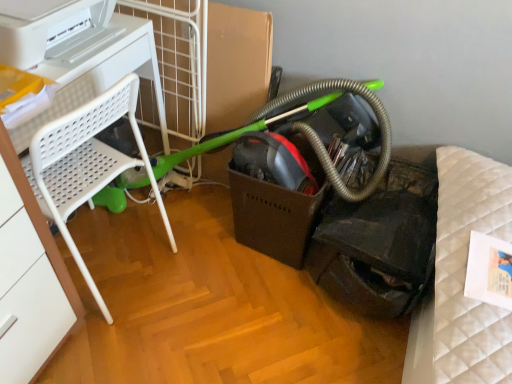
Question: From their relative heights in the image, would you say white plastic chair at left is taller or shorter than green rubber garden hose at center?

Choices:
 (A) short
 (B) tall

Answer: (B)

Question: Based on their sizes in the image, would you say white plastic chair at left is bigger or smaller than green rubber garden hose at center?

Choices:
 (A) big
 (B) small

Answer: (A)

Question: Which is farther from the green rubber garden hose at center?

Choices:
 (A) white plastic chair at left
 (B) white plastic printer at upper left
 (C) white plastic chair at left

Answer: (B)

Question: Based on their relative distances, which object is nearer to the white plastic chair at left?

Choices:
 (A) white plastic printer at upper left
 (B) white plastic chair at left
 (C) green rubber garden hose at center

Answer: (B)